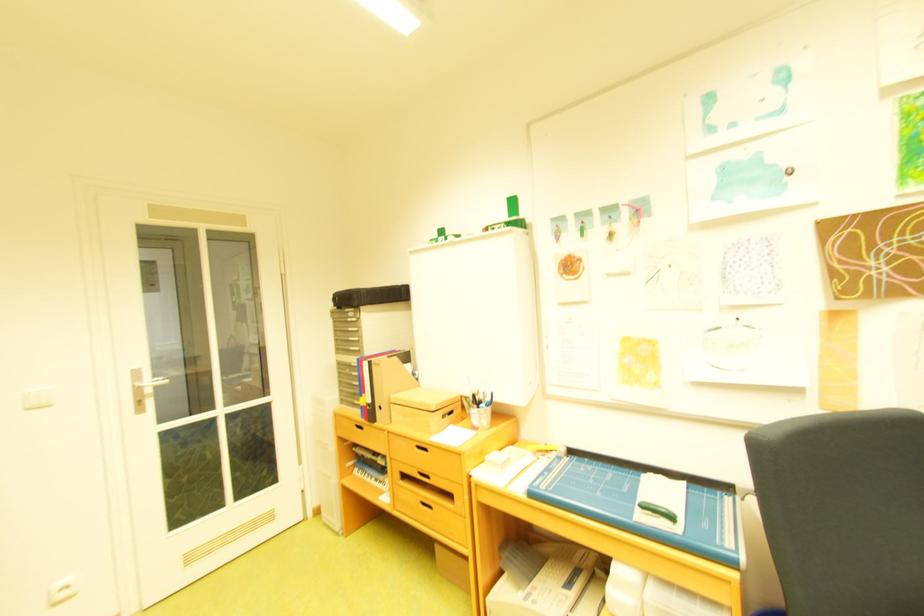
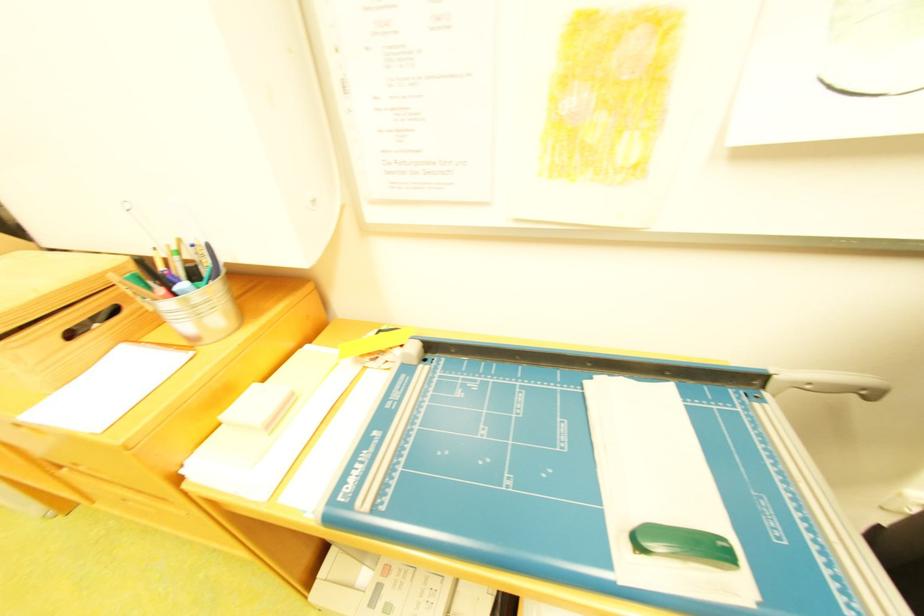
The point at [487,407] is marked in the first image. Where is the corresponding point in the second image?

(173, 292)